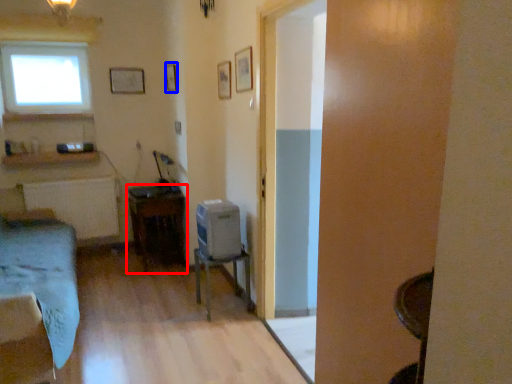
Question: Which point is further to the camera, table (highlighted by a red box) or picture frame (highlighted by a blue box)?

Choices:
 (A) table
 (B) picture frame

Answer: (B)